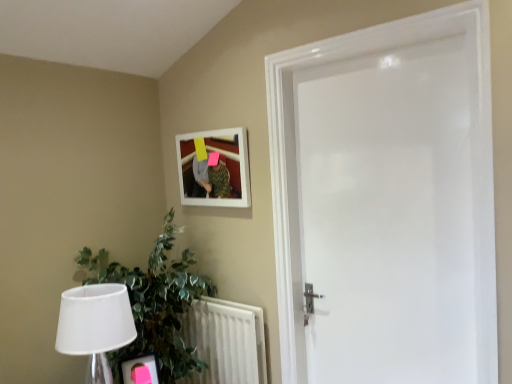
Question: From a real-world perspective, is white glossy door at center over white textured radiator at lower left?

Choices:
 (A) yes
 (B) no

Answer: (A)

Question: From the image's perspective, is white glossy door at center below white textured radiator at lower left?

Choices:
 (A) yes
 (B) no

Answer: (B)

Question: Is white glossy door at center with white textured radiator at lower left?

Choices:
 (A) yes
 (B) no

Answer: (B)

Question: Is white glossy door at center positioned in front of white textured radiator at lower left?

Choices:
 (A) yes
 (B) no

Answer: (A)

Question: Does white glossy door at center have a lesser width compared to white textured radiator at lower left?

Choices:
 (A) yes
 (B) no

Answer: (B)

Question: From a real-world perspective, is white glossy door at center beneath white textured radiator at lower left?

Choices:
 (A) yes
 (B) no

Answer: (B)

Question: Is green leafy plant at lower left smaller than white fabric lampshade at lower left?

Choices:
 (A) yes
 (B) no

Answer: (B)

Question: Is green leafy plant at lower left positioned behind white fabric lampshade at lower left?

Choices:
 (A) yes
 (B) no

Answer: (A)

Question: Would you say green leafy plant at lower left is outside white fabric lampshade at lower left?

Choices:
 (A) yes
 (B) no

Answer: (A)

Question: Is green leafy plant at lower left to the left of white fabric lampshade at lower left from the viewer's perspective?

Choices:
 (A) yes
 (B) no

Answer: (B)

Question: Is green leafy plant at lower left oriented towards white fabric lampshade at lower left?

Choices:
 (A) yes
 (B) no

Answer: (B)

Question: Does green leafy plant at lower left have a lesser width compared to white fabric lampshade at lower left?

Choices:
 (A) no
 (B) yes

Answer: (A)

Question: Can you confirm if white fabric lampshade at lower left is positioned to the left of white glossy door at center?

Choices:
 (A) yes
 (B) no

Answer: (A)